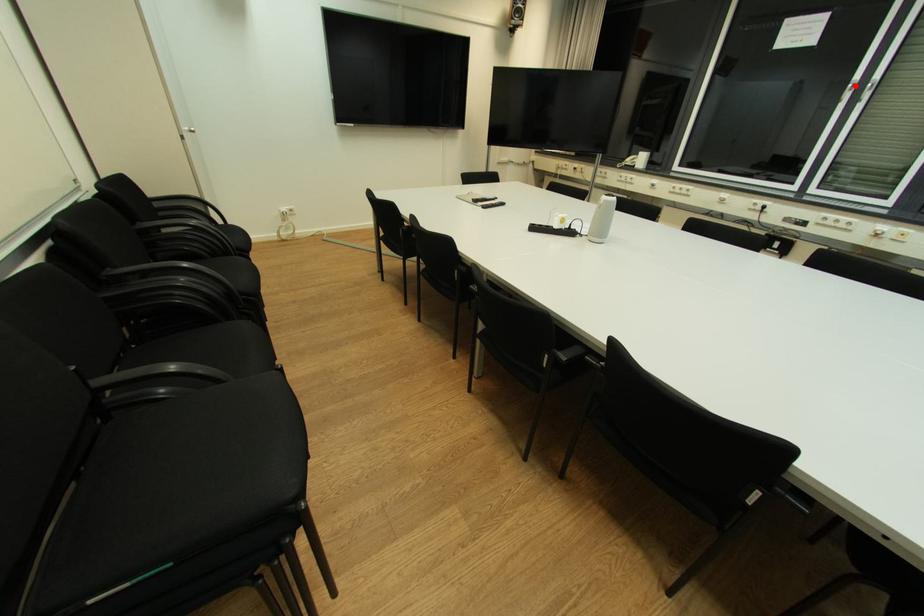
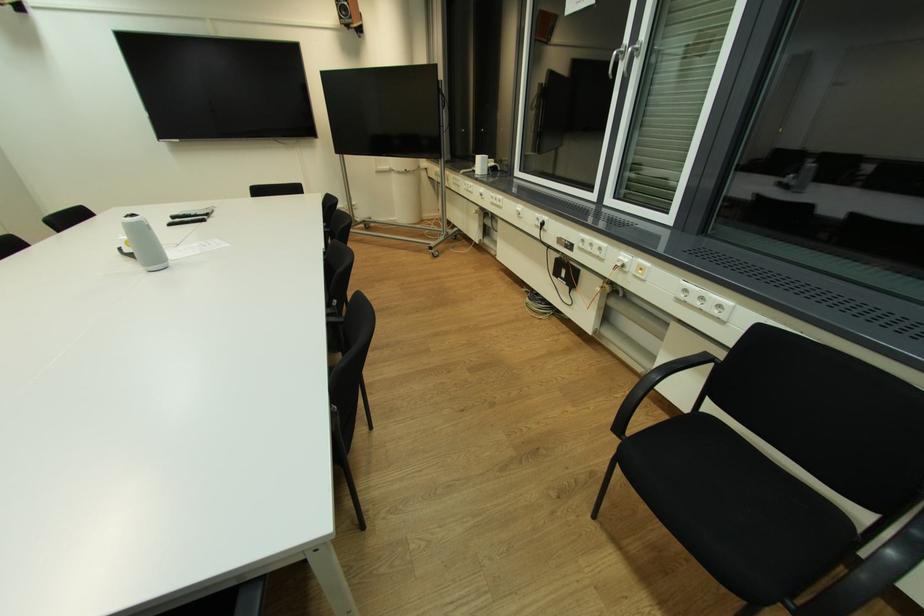
Question: I am providing you with two images of the same scene from different viewpoints. Given a red point in image1, look at the same physical point in image2. Is it:

Choices:
 (A) Closer to the viewpoint
 (B) Farther from the viewpoint

Answer: (A)